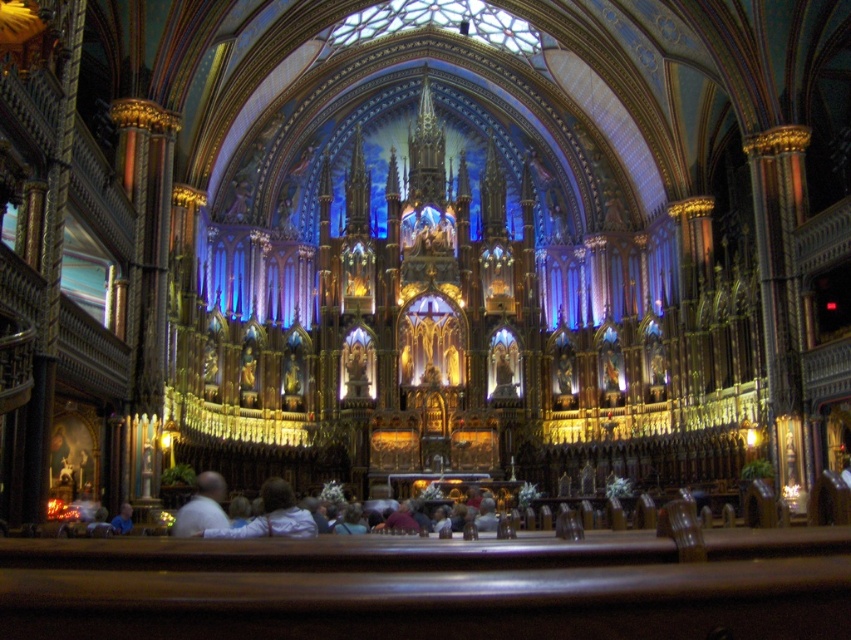
Question: Which of these objects is positioned farthest from the light blue shirt at lower center?

Choices:
 (A) light blue shirt at lower left
 (B) white matte shirt at lower center

Answer: (A)

Question: Considering the relative positions of white matte shirt at lower center and light blue shirt at lower left in the image provided, where is white matte shirt at lower center located with respect to light blue shirt at lower left?

Choices:
 (A) left
 (B) right

Answer: (B)

Question: Which of the following is the closest to the observer?

Choices:
 (A) (129, 512)
 (B) (281, 536)
 (C) (193, 493)

Answer: (B)

Question: Which point is farther to the camera?

Choices:
 (A) 210,493
 (B) 116,529
 (C) 208,531

Answer: (B)

Question: Is light blue shirt at lower center wider than light blue shirt at lower left?

Choices:
 (A) yes
 (B) no

Answer: (A)

Question: Can you confirm if light blue shirt at lower center is positioned below light blue shirt at lower left?

Choices:
 (A) no
 (B) yes

Answer: (A)